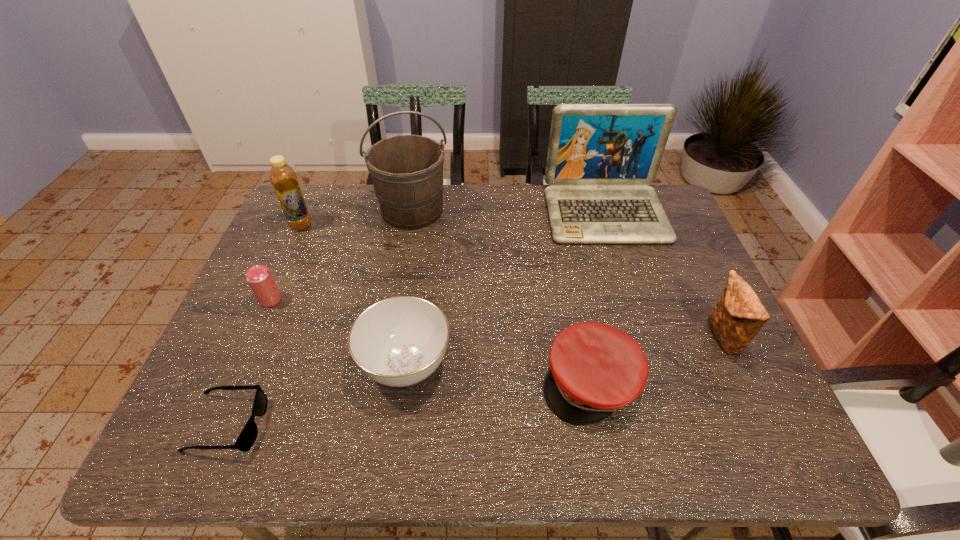
At what (x,y) coordinates should I click in order to perform the action: click on bucket. Please return your answer as a coordinate pair (x, y). The width and height of the screenshot is (960, 540). Looking at the image, I should click on (407, 170).

Locate an element on the screen. The height and width of the screenshot is (540, 960). laptop computer is located at coordinates 601,157.

Where is `bottle`? bottle is located at coordinates (283, 177).

Identify the location of the fourth tallest object. Image resolution: width=960 pixels, height=540 pixels. (739, 315).

Identify the location of chinaware. This screenshot has width=960, height=540. (400, 341).

I want to click on beer can, so click(259, 277).

Where is `cap`? This screenshot has width=960, height=540. cap is located at coordinates (596, 369).

Locate an element on the screen. the shortest object is located at coordinates [x=246, y=439].

You are a GUI agent. You are given a task and a screenshot of the screen. Output one action in this format:
    pyautogui.click(x=<x>, y=<y>)
    Task: Click on the free space located 0.280m on the front of the bucket
    The image size is (960, 540).
    Given the screenshot: What is the action you would take?
    pyautogui.click(x=396, y=304)

Locate an element on the screen. Image resolution: width=960 pixels, height=540 pixels. free point located on the screen of the seventh shortest object is located at coordinates (629, 288).